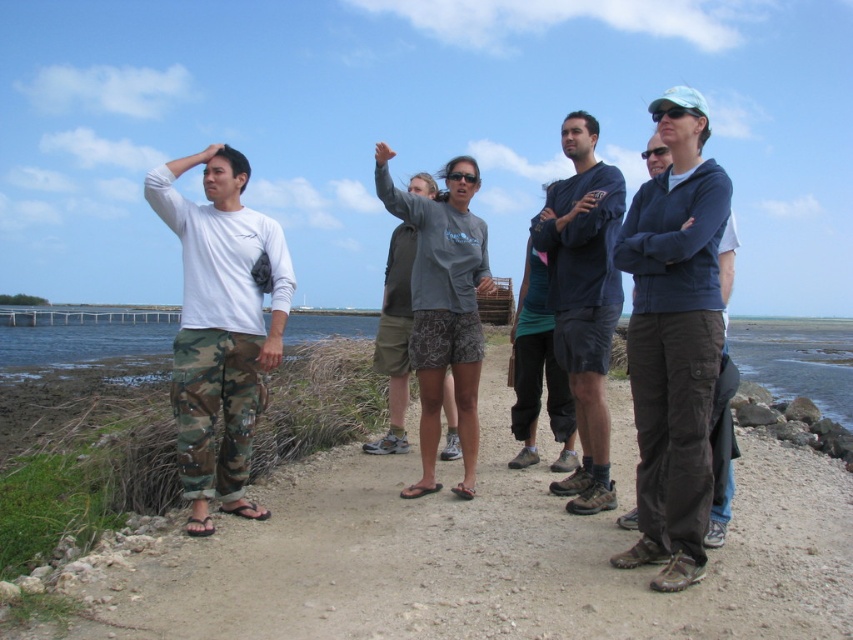
You are a photographer trying to capture a group photo of the camo pants at left and the dark blue fabric shirt at center. Since you want to ensure both subjects are in focus, you need to know which one is wider. Which one has a greater width?

The camo pants at left has a greater width than the dark blue fabric shirt at center.

You are a photographer trying to capture a group photo of the camo pants at left and the dark blue fabric shirt at center. Since you want both subjects to be in focus, you need to adjust your camera settings based on their heights. Which subject should you focus on first to ensure proper depth of field?

The camo pants at left is not as tall as the dark blue fabric shirt at center. To ensure both are in focus, you should focus on the taller subject, the dark blue fabric shirt at center, as depth of field is more effective when focusing on the subject farther away.